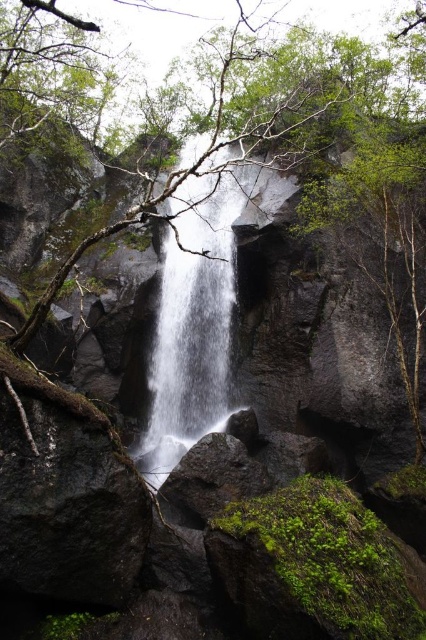
You are a hiker trying to determine which object is taller between the smooth bark tree at center and the dark gray rock at center in the waterfall scene. Based on the description, which one is taller?

The smooth bark tree at center is taller than the dark gray rock at center.

You are a hiker who wants to take a photo of the white textured waterfall at center. You notice a smooth bark tree at center in the way. Can you move the tree to get a clear shot of the waterfall?

The smooth bark tree at center is located above the white textured waterfall at center, so you cannot move the tree as it is part of the natural landscape. To get a clear shot of the waterfall, you may need to position yourself below the tree or adjust your angle to avoid blocking the view.

You are standing at the base of the waterfall and want to take a photo of the smooth bark tree at center. If your camera has a maximum zoom range of 15 feet, will you need to move closer to capture the tree in focus?

The smooth bark tree at center is 20.67 feet away from the viewer. Since the camera can only zoom up to 15 feet, you will need to move closer to ensure the tree is in focus.